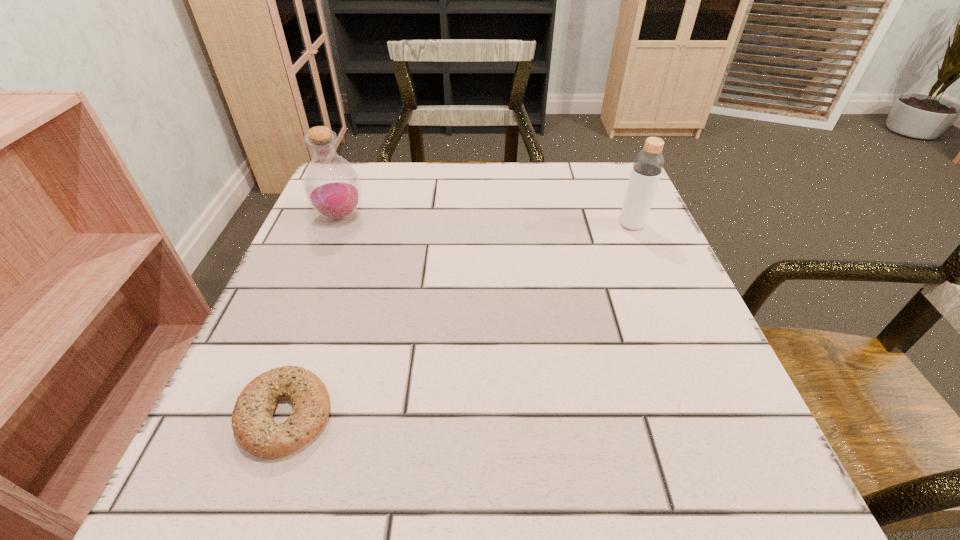
I want to click on the left bottle, so click(332, 187).

The height and width of the screenshot is (540, 960). I want to click on the rightmost object, so click(x=648, y=164).

Identify the location of the nearest object. (252, 421).

The width and height of the screenshot is (960, 540). Find the location of `bagel`. bagel is located at coordinates (252, 421).

Locate an element on the screen. The height and width of the screenshot is (540, 960). vacant space located on the right of the left bottle is located at coordinates (496, 217).

At what (x,y) coordinates should I click in order to perform the action: click on free space located 0.290m on the front of the rightmost object. Please return your answer as a coordinate pair (x, y). This screenshot has height=540, width=960. Looking at the image, I should click on (680, 339).

Locate an element on the screen. vacant area situated on the right of the nearest object is located at coordinates (459, 416).

This screenshot has width=960, height=540. I want to click on object present at the far edge, so click(332, 187).

The image size is (960, 540). Find the location of `object at the near edge`. object at the near edge is located at coordinates click(252, 421).

Where is `bottle present at the left edge`? The height and width of the screenshot is (540, 960). bottle present at the left edge is located at coordinates (332, 187).